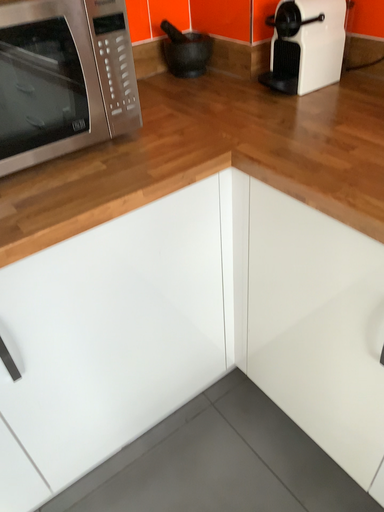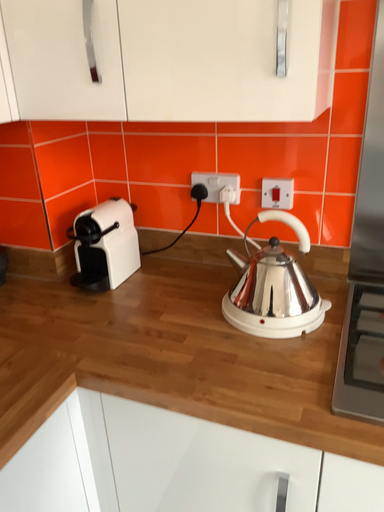
Question: How did the camera likely rotate when shooting the video?

Choices:
 (A) rotated left
 (B) rotated right

Answer: (B)